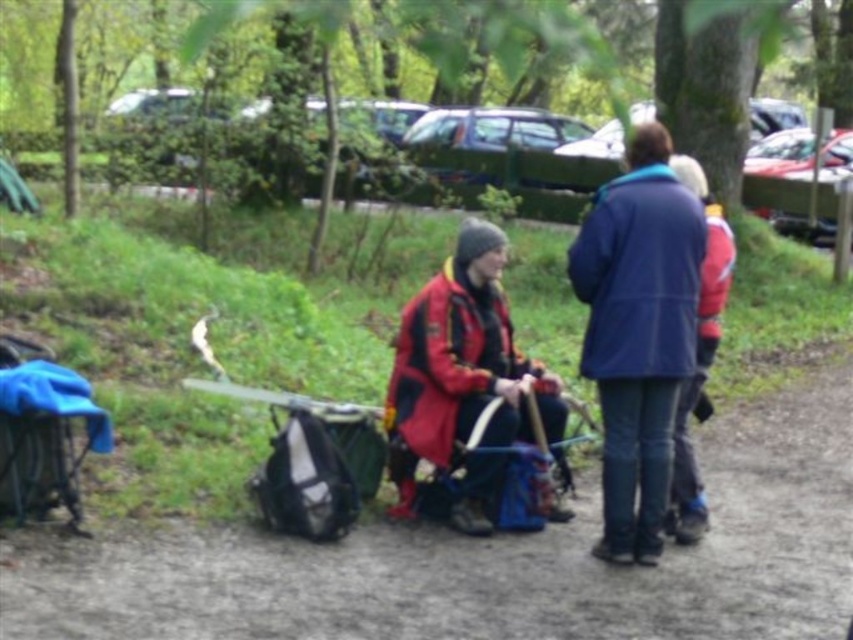
Who is higher up, dirt ground at center or red matte jacket at center?

red matte jacket at center

Between point (245, 608) and point (479, 493), which one is positioned behind?

Positioned behind is point (479, 493).

Image resolution: width=853 pixels, height=640 pixels. What do you see at coordinates (486, 560) in the screenshot?
I see `dirt ground at center` at bounding box center [486, 560].

Locate an element on the screen. dirt ground at center is located at coordinates (486, 560).

Is dirt ground at center to the left of blue fabric coat at upper right from the viewer's perspective?

Correct, you'll find dirt ground at center to the left of blue fabric coat at upper right.

Can you confirm if dirt ground at center is thinner than blue fabric coat at upper right?

In fact, dirt ground at center might be wider than blue fabric coat at upper right.

Where is `dirt ground at center`? The image size is (853, 640). dirt ground at center is located at coordinates (486, 560).

Is blue fabric coat at upper right taller than red matte jacket at center?

Yes.

Is point (637, 225) farther from viewer compared to point (547, 516)?

No, it is not.

This screenshot has width=853, height=640. I want to click on blue fabric coat at upper right, so click(x=637, y=332).